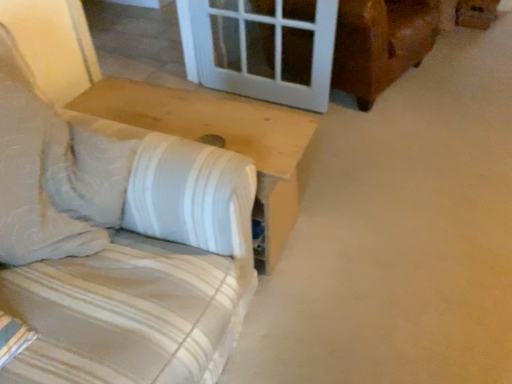
Identify the location of free space to the right of white wood table at lower left. (360, 224).